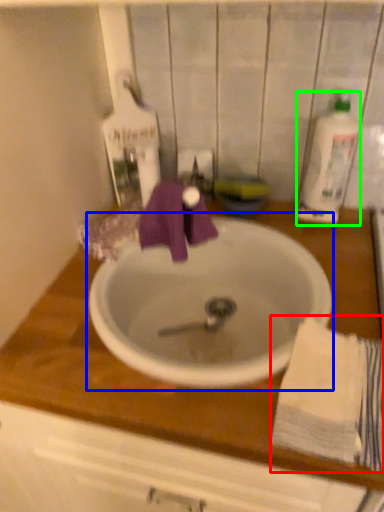
Question: Estimate the real-world distances between objects in this image. Which object is farther from bath towel (highlighted by a red box), sink (highlighted by a blue box) or cleaning product (highlighted by a green box)?

Choices:
 (A) sink
 (B) cleaning product

Answer: (B)